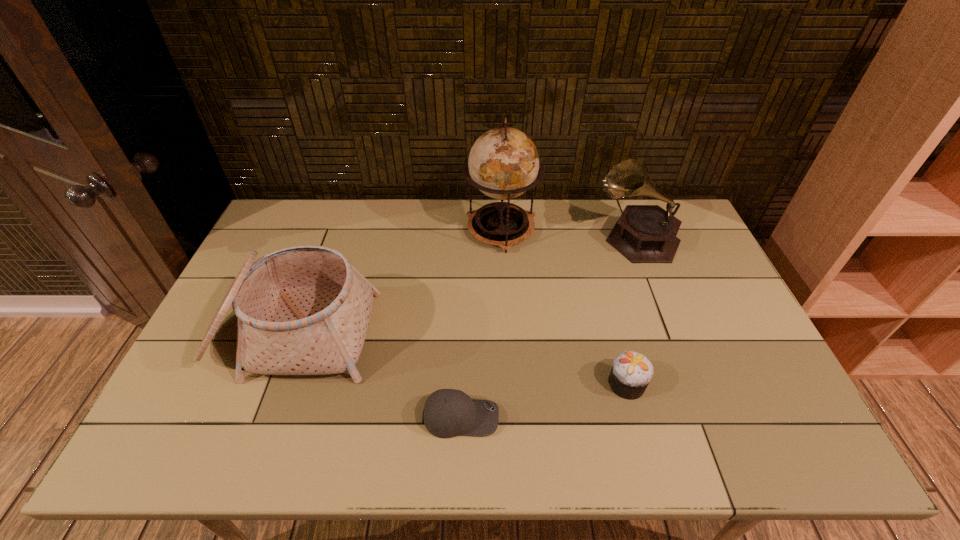
I want to click on vacant area at the right edge, so click(668, 269).

You are a GUI agent. You are given a task and a screenshot of the screen. Output one action in this format:
    pyautogui.click(x=<x>, y=<y>)
    Task: Click on the vacant position at the far left corner of the desktop
    
    Given the screenshot: What is the action you would take?
    pyautogui.click(x=298, y=201)

Where is `vacant area that lies between the tallest object and the basket`? The width and height of the screenshot is (960, 540). vacant area that lies between the tallest object and the basket is located at coordinates (396, 282).

Find the location of a particular element. free space between the phonograph record and the baseball cap is located at coordinates (549, 327).

Locate an element on the screen. The image size is (960, 540). vacant point located between the phonograph record and the cupcake is located at coordinates (632, 310).

The width and height of the screenshot is (960, 540). I want to click on vacant region between the shortest object and the leftmost object, so point(376,376).

You are a GUI agent. You are given a task and a screenshot of the screen. Output one action in this format:
    pyautogui.click(x=<x>, y=<y>)
    Task: Click on the vacant point located between the phonograph record and the basket
    The image size is (960, 540).
    Given the screenshot: What is the action you would take?
    pyautogui.click(x=465, y=286)

Find the location of a particular element. empty location between the tallest object and the baseball cap is located at coordinates (481, 323).

Locate an element on the screen. The width and height of the screenshot is (960, 540). free point between the phonograph record and the leftmost object is located at coordinates (465, 286).

Identify the location of vacant space that is in between the cupcake and the leftmost object. (459, 359).